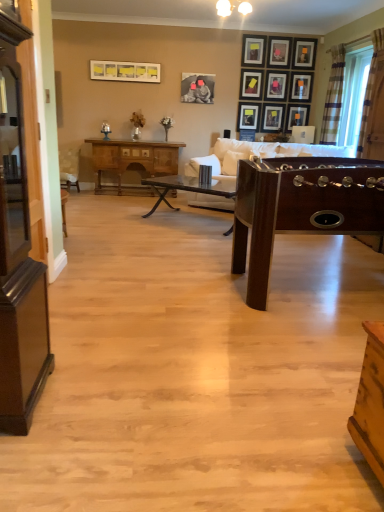
Locate an element on the screen. This screenshot has width=384, height=512. vacant region to the left of mahogany wood foosball table at right, which is the 3th table in back-to-front order is located at coordinates (145, 298).